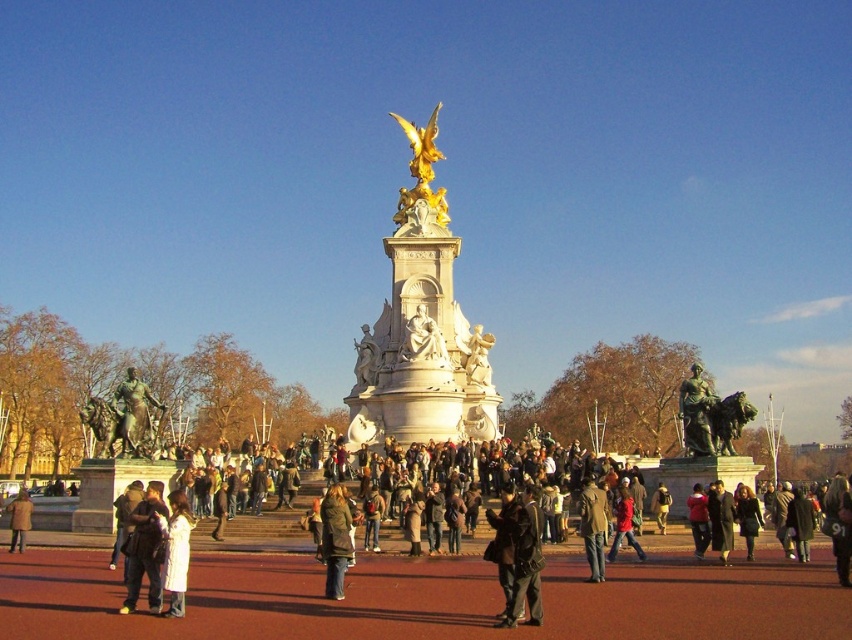
Question: Is bronze statue of man on horse at center to the right of dark brown leather jacket at lower left from the viewer's perspective?

Choices:
 (A) yes
 (B) no

Answer: (A)

Question: Does dark brown leather jacket at lower left come in front of light brown leather jacket at center?

Choices:
 (A) no
 (B) yes

Answer: (B)

Question: Which of the following is the farthest from the observer?

Choices:
 (A) light brown leather coat at lower left
 (B) bronze statue at left

Answer: (A)

Question: Which of the following is the farthest from the observer?

Choices:
 (A) light brown leather jacket at center
 (B) brown leather jacket at center

Answer: (A)

Question: Is dark brown coat at lower right positioned behind dark brown leather coat at center?

Choices:
 (A) yes
 (B) no

Answer: (B)

Question: Among these points, which one is nearest to the camera?

Choices:
 (A) (181, 528)
 (B) (415, 509)

Answer: (A)